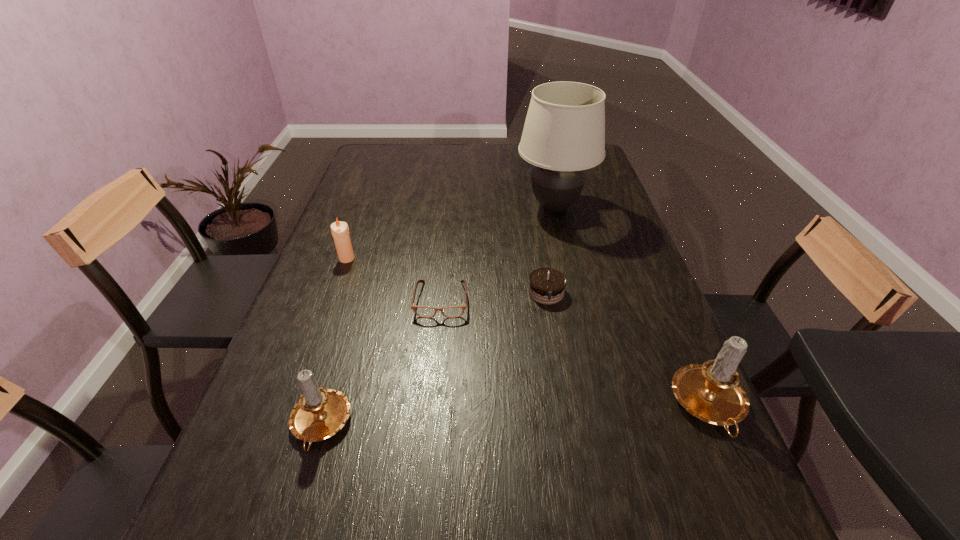
This screenshot has width=960, height=540. What are the coordinates of `object that is the second closest to the shortest object` in the screenshot? It's located at (340, 231).

The height and width of the screenshot is (540, 960). Identify the location of the second closest object to the shortest object. (340, 231).

At what (x,y) coordinates should I click in order to perform the action: click on candle that stands as the second closest to the tallest candle. Please return your answer as a coordinate pair (x, y). The width and height of the screenshot is (960, 540). Looking at the image, I should click on [x=340, y=231].

At what (x,y) coordinates should I click in order to perform the action: click on the second closest candle to the chocolate cake. Please return your answer as a coordinate pair (x, y). The width and height of the screenshot is (960, 540). Looking at the image, I should click on (320, 413).

This screenshot has width=960, height=540. Identify the location of vacant region that satisfies the following two spatial constraints: 1. on the back side of the farthest object; 2. on the left side of the farthest candle. (366, 207).

Find the location of a particular element. This screenshot has height=540, width=960. free space that satisfies the following two spatial constraints: 1. on the front-facing side of the shortest object; 2. on the left side of the fifth shortest object is located at coordinates (431, 407).